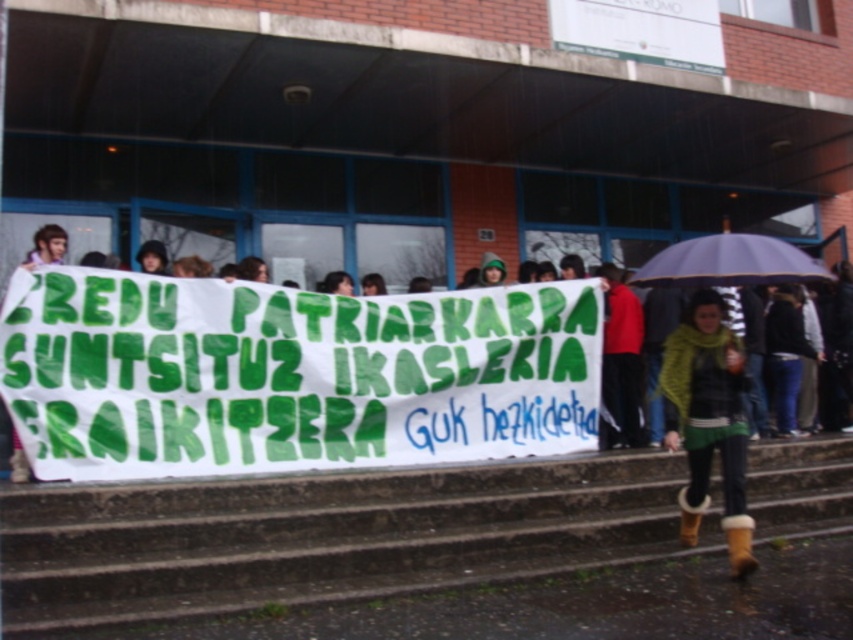
Does concrete stairs at center have a smaller size compared to red matte jacket at center?

Actually, concrete stairs at center might be larger than red matte jacket at center.

Does concrete stairs at center have a greater width compared to red matte jacket at center?

Indeed, concrete stairs at center has a greater width compared to red matte jacket at center.

Identify the location of concrete stairs at center. This screenshot has height=640, width=853. click(328, 536).

Locate an element on the screen. This screenshot has width=853, height=640. concrete stairs at center is located at coordinates (328, 536).

Looking at this image, can you confirm if concrete stairs at center is positioned to the right of light brown hair at upper left?

Indeed, concrete stairs at center is positioned on the right side of light brown hair at upper left.

Who is more forward, (x=59, y=536) or (x=137, y=252)?

Point (x=59, y=536)

You are a GUI agent. You are given a task and a screenshot of the screen. Output one action in this format:
    pyautogui.click(x=<x>, y=<y>)
    Task: Click on the concrete stairs at center
    This screenshot has height=640, width=853.
    Given the screenshot: What is the action you would take?
    pyautogui.click(x=328, y=536)

Is concrete stairs at center wider than green fuzzy boots at lower right?

Indeed, concrete stairs at center has a greater width compared to green fuzzy boots at lower right.

Which is behind, point (384, 545) or point (724, 364)?

The point (724, 364) is more distant.

Where is `concrete stairs at center`? This screenshot has width=853, height=640. concrete stairs at center is located at coordinates (328, 536).